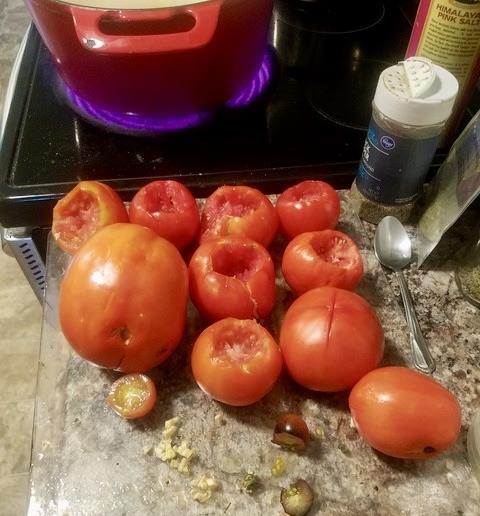
Find the location of a particular element. Image resolution: width=480 pixels, height=516 pixels. spoon is located at coordinates (391, 241).